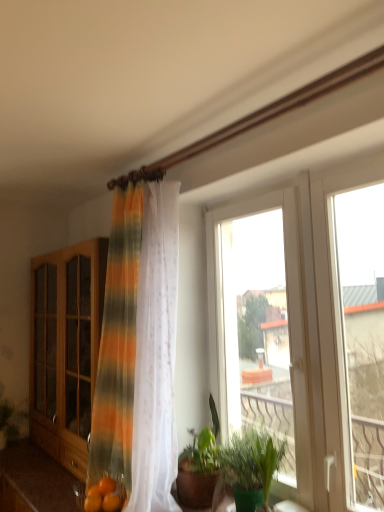
This screenshot has height=512, width=384. I want to click on vacant space situated above transparent glass window at right, the 3th window when ordered from left to right (from a real-world perspective), so click(x=341, y=168).